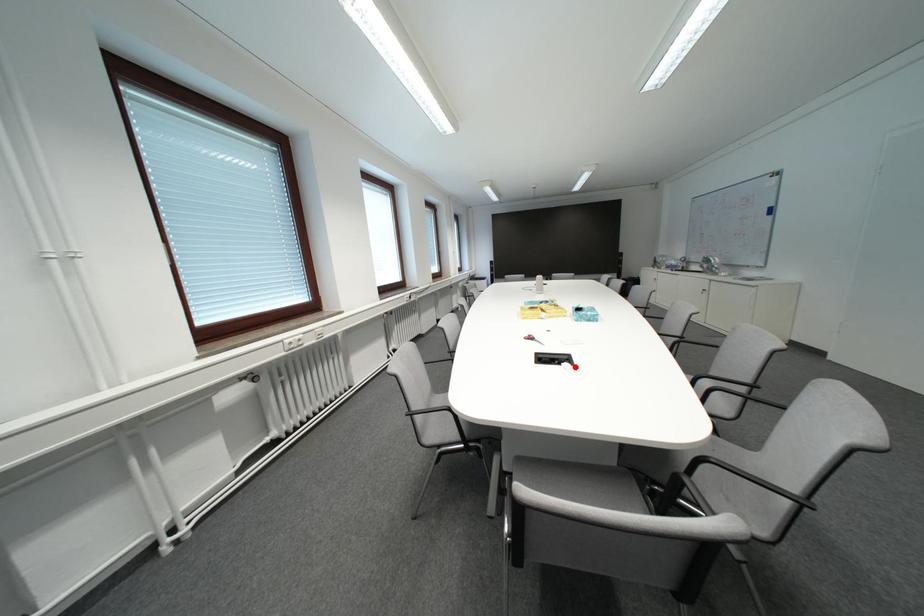
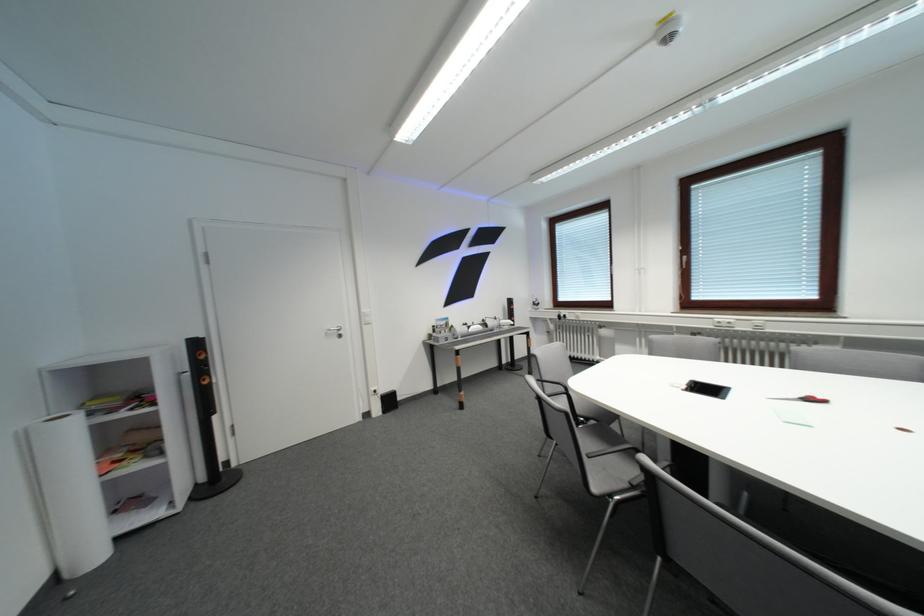
Where in the second image is the point corresponding to the highlighted location from the first image?

(695, 389)